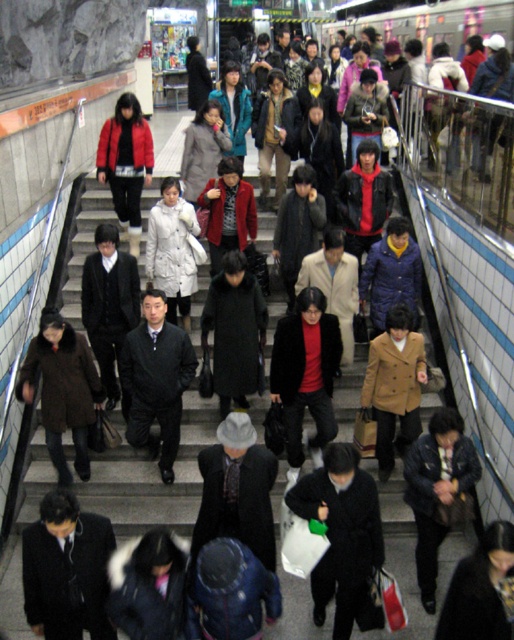
Question: Which point is closer to the camera?

Choices:
 (A) pos(59,611)
 (B) pos(183,353)
 (C) pos(351,616)

Answer: (A)

Question: Is black matte coat at center thinner than black wool coat at center?

Choices:
 (A) yes
 (B) no

Answer: (B)

Question: Is black fabric coat at center to the right of brown leather coat at center from the viewer's perspective?

Choices:
 (A) no
 (B) yes

Answer: (B)

Question: Among these objects, which one is farthest from the camera?

Choices:
 (A) black matte coat at center
 (B) matte brown coat at center

Answer: (A)

Question: Among these points, which one is nearest to the camera?

Choices:
 (A) [103, 376]
 (B) [378, 538]

Answer: (B)

Question: Does brown leather coat at center come in front of matte brown coat at center?

Choices:
 (A) yes
 (B) no

Answer: (A)